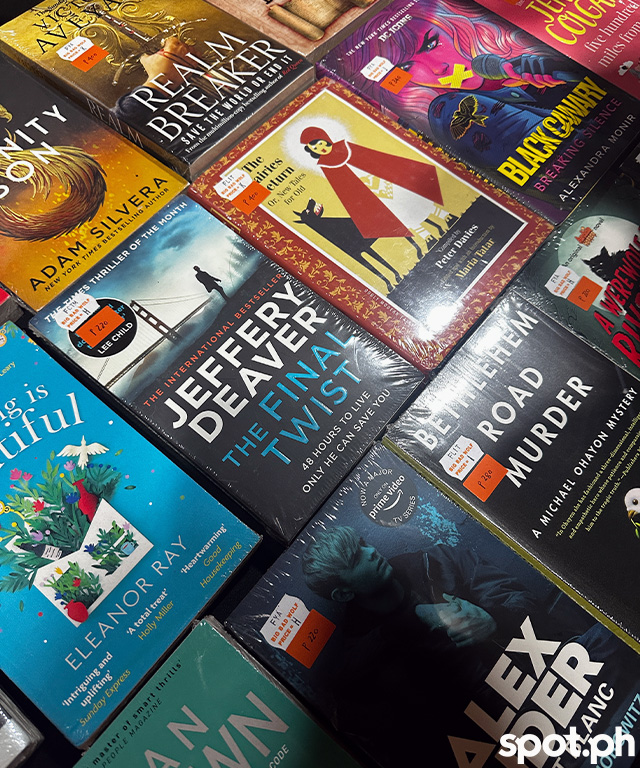
You are a GUI agent. You are given a task and a screenshot of the screen. Output one action in this format:
    pyautogui.click(x=<x>, y=<y>)
    Task: Click on the book
    This screenshot has width=640, height=768.
    Given the screenshot: What is the action you would take?
    pyautogui.click(x=276, y=495)